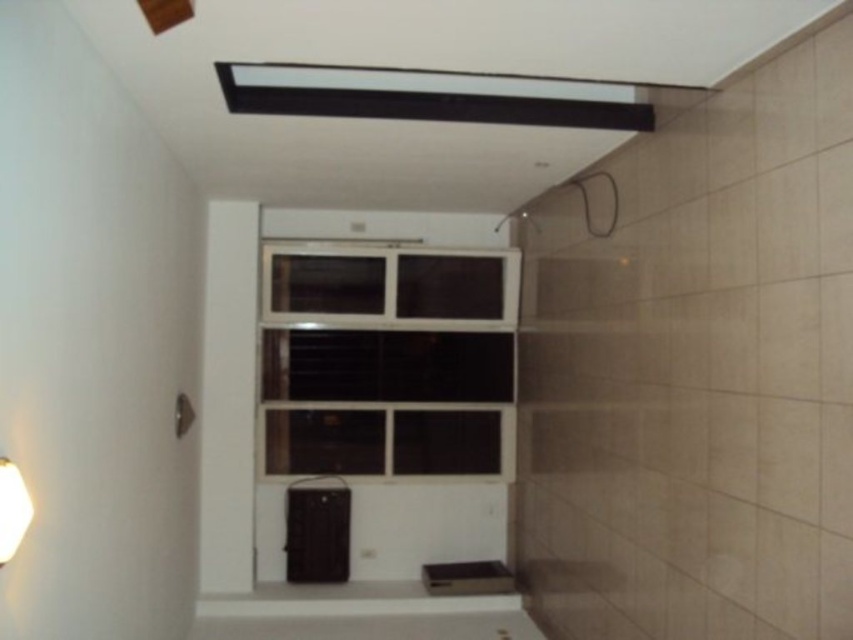
Question: Among these objects, which one is nearest to the camera?

Choices:
 (A) clear glass window at center
 (B) white matte lampshade at lower left
 (C) white glossy bath at lower center
 (D) black plastic speaker at lower center

Answer: (B)

Question: In this image, where is clear glass window at center located relative to black plastic speaker at lower center?

Choices:
 (A) right
 (B) left

Answer: (A)

Question: Where is black plastic speaker at lower center located in relation to white matte lampshade at lower left in the image?

Choices:
 (A) above
 (B) below

Answer: (B)

Question: In this image, where is clear glass window at center located relative to white matte lampshade at lower left?

Choices:
 (A) above
 (B) below

Answer: (A)

Question: Which point appears closest to the camera in this image?

Choices:
 (A) (16, 506)
 (B) (318, 502)

Answer: (A)

Question: Which object appears farthest from the camera in this image?

Choices:
 (A) black plastic speaker at lower center
 (B) clear glass window at center

Answer: (A)